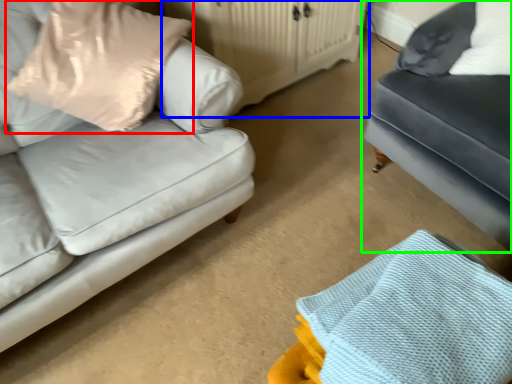
Question: Which object is the farthest from pillow (highlighted by a red box)? Choose among these: dresser (highlighted by a blue box) or studio couch (highlighted by a green box).

Choices:
 (A) dresser
 (B) studio couch

Answer: (B)